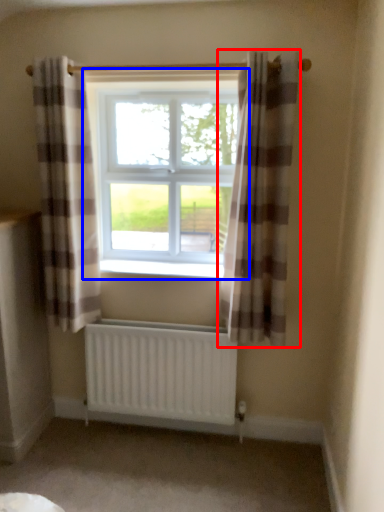
Question: Which object appears closest to the camera in this image, curtain (highlighted by a red box) or window (highlighted by a blue box)?

Choices:
 (A) curtain
 (B) window

Answer: (A)